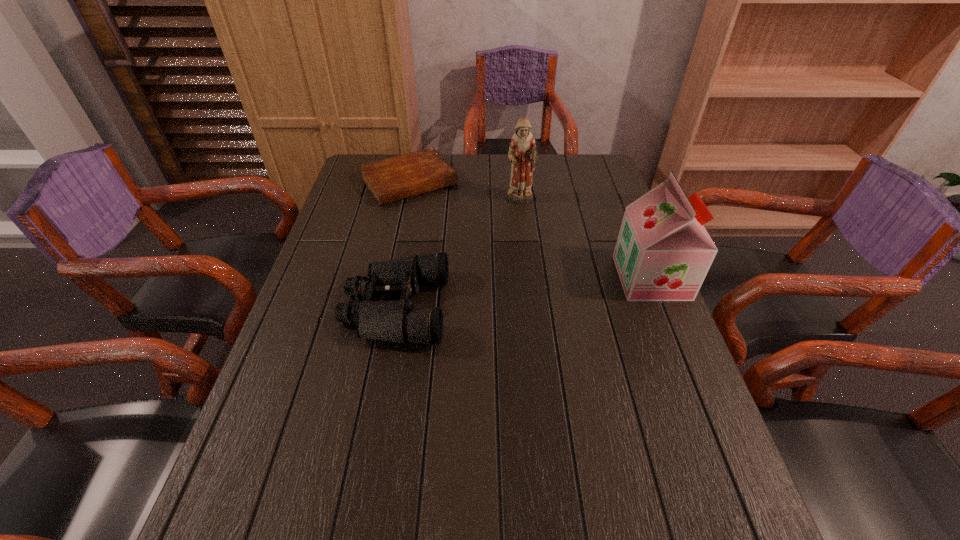
Locate an element on the screen. free space located 0.050m on the spine side of the Bible is located at coordinates (435, 212).

Locate an element on the screen. The image size is (960, 540). object present at the far edge is located at coordinates (396, 178).

Find the location of a particular element. This screenshot has width=960, height=540. binoculars located in the left edge section of the desktop is located at coordinates (396, 321).

Identify the location of Bible positioned at the left edge. Image resolution: width=960 pixels, height=540 pixels. (396, 178).

You are a GUI agent. You are given a task and a screenshot of the screen. Output one action in this format:
    pyautogui.click(x=<x>, y=<y>)
    Task: Click on the object positioned at the right edge
    
    Given the screenshot: What is the action you would take?
    pyautogui.click(x=663, y=252)

This screenshot has width=960, height=540. I want to click on object that is at the far left corner, so click(396, 178).

Locate an element on the screen. The height and width of the screenshot is (540, 960). vacant area at the near edge of the desktop is located at coordinates (528, 445).

The width and height of the screenshot is (960, 540). What are the coordinates of `vacant space at the left edge of the desktop` in the screenshot? It's located at click(339, 205).

In the image, there is a desktop. Where is `vacant space at the right edge`? vacant space at the right edge is located at coordinates (591, 224).

Locate an element on the screen. The width and height of the screenshot is (960, 540). free space at the near right corner of the desktop is located at coordinates (725, 462).